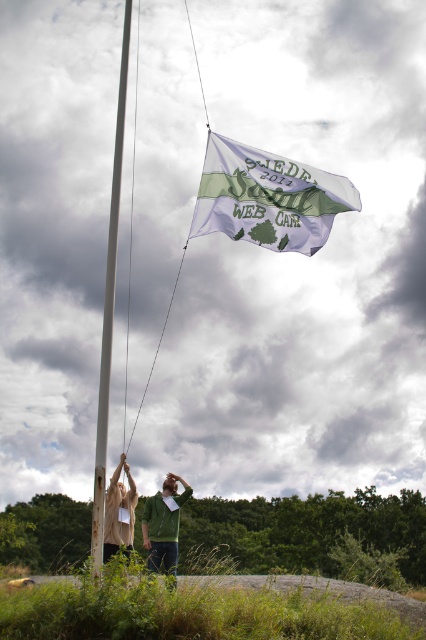
Is point (173, 481) positioned after point (108, 547)?

Yes, it is behind point (108, 547).

Who is shorter, green cotton hoodie at center or beige cotton hoodie at lower left?

Standing shorter between the two is green cotton hoodie at center.

The image size is (426, 640). What do you see at coordinates (164, 524) in the screenshot?
I see `green cotton hoodie at center` at bounding box center [164, 524].

Find the location of a particular element. The width and height of the screenshot is (426, 640). green cotton hoodie at center is located at coordinates (164, 524).

Measure the distance from white fabric flag at upper center to beige cotton hoodie at lower left.

A distance of 7.19 meters exists between white fabric flag at upper center and beige cotton hoodie at lower left.

Locate an element on the screen. This screenshot has height=640, width=426. white fabric flag at upper center is located at coordinates (267, 196).

Where is `white fabric flag at upper center`? The height and width of the screenshot is (640, 426). white fabric flag at upper center is located at coordinates (x=267, y=196).

Locate an element on the screen. Image resolution: width=426 pixels, height=640 pixels. white fabric flag at upper center is located at coordinates (267, 196).

Is white fabric flag at upper center positioned before green cotton hoodie at center?

Yes.

Is point (258, 150) farther from viewer compared to point (155, 516)?

That is False.

Find the location of a particular element. This screenshot has width=426, height=640. white fabric flag at upper center is located at coordinates (267, 196).